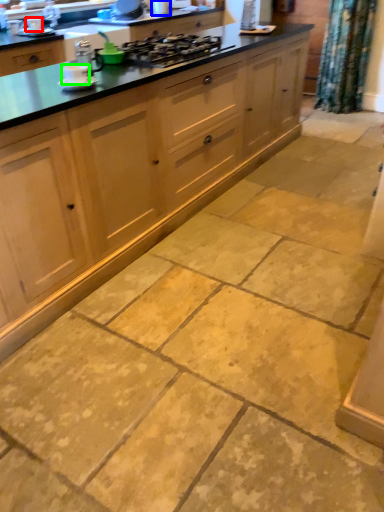
Question: Based on their relative distances, which object is nearer to appliance (highlighted by a red box)? Choose from appliance (highlighted by a blue box) and appliance (highlighted by a green box).

Choices:
 (A) appliance
 (B) appliance

Answer: (A)